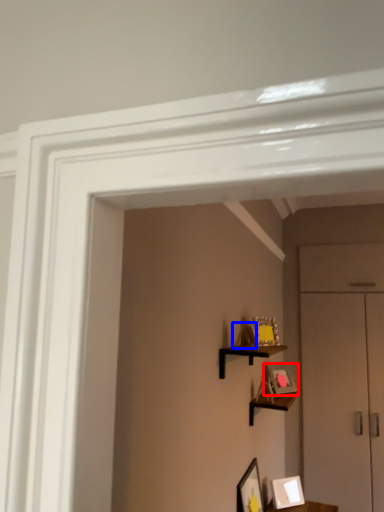
Question: Which object appears closest to the camera in this image, picture frame (highlighted by a red box) or picture frame (highlighted by a blue box)?

Choices:
 (A) picture frame
 (B) picture frame

Answer: (B)